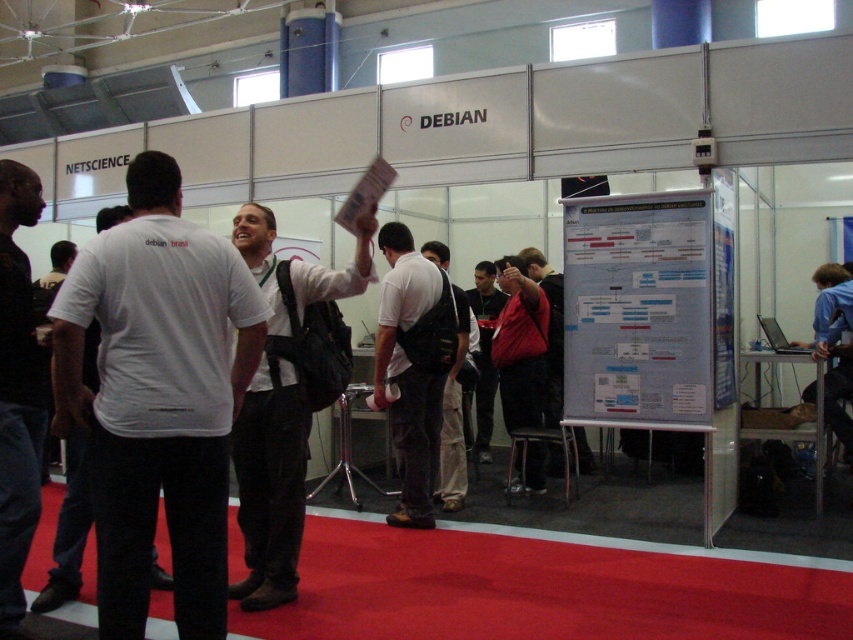
Which is above, dark gray fabric backpack at center or leather jacket at center?

Positioned higher is leather jacket at center.

Is point (250, 605) behind point (537, 300)?

No, it is in front of (537, 300).

Find the location of a particular element. Image resolution: width=853 pixels, height=640 pixels. dark gray fabric backpack at center is located at coordinates (270, 483).

In the scene shown: Does white paper poster at center have a greater width compared to red jacket at center?

Yes, white paper poster at center is wider than red jacket at center.

Describe the element at coordinates (723, 285) in the screenshot. I see `white paper poster at center` at that location.

This screenshot has width=853, height=640. Describe the element at coordinates (723, 285) in the screenshot. I see `white paper poster at center` at that location.

Locate an element on the screen. The height and width of the screenshot is (640, 853). white paper poster at center is located at coordinates (723, 285).

Does dark gray fabric backpack at center appear over dark gray jeans at left?

Incorrect, dark gray fabric backpack at center is not positioned above dark gray jeans at left.

Does dark gray fabric backpack at center have a lesser height compared to dark gray jeans at left?

Indeed, dark gray fabric backpack at center has a lesser height compared to dark gray jeans at left.

At what (x,y) coordinates should I click in order to perform the action: click on dark gray fabric backpack at center. Please return your answer as a coordinate pair (x, y). The height and width of the screenshot is (640, 853). Looking at the image, I should click on (270, 483).